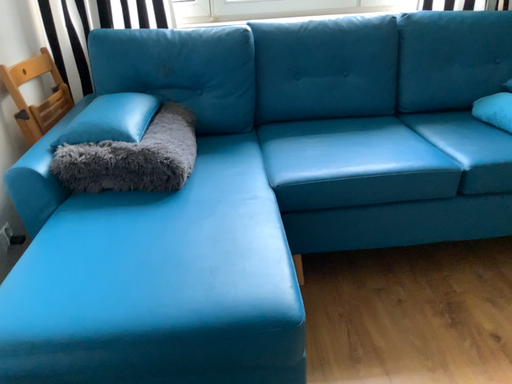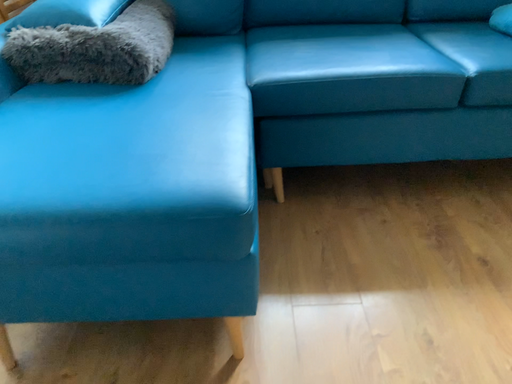
Question: How did the camera likely rotate when shooting the video?

Choices:
 (A) rotated upward
 (B) rotated downward

Answer: (B)